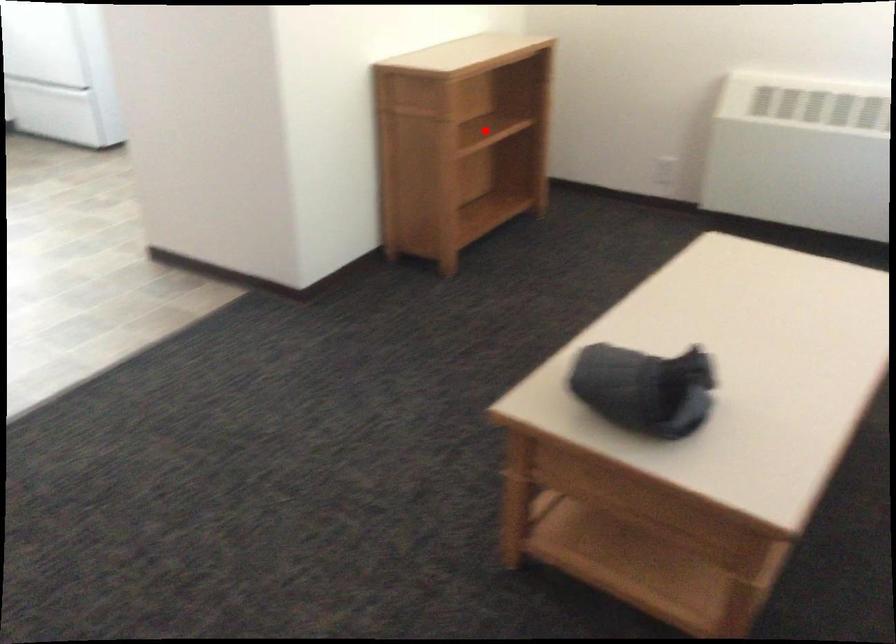
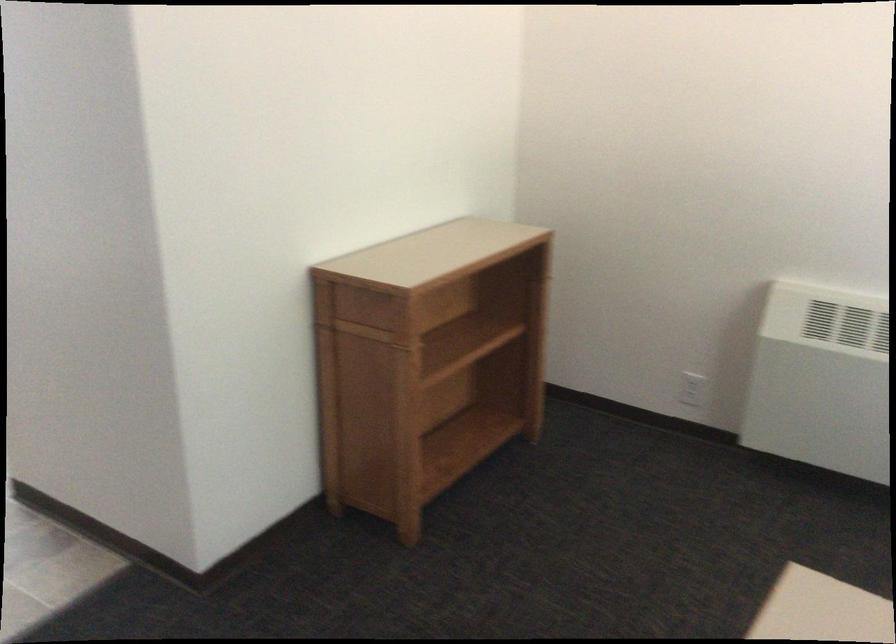
Question: I am providing you with two images of the same scene from different viewpoints. A red point is shown in image1. For the corresponding object point in image2, is it positioned nearer or farther from the camera?

Choices:
 (A) Nearer
 (B) Farther

Answer: (A)